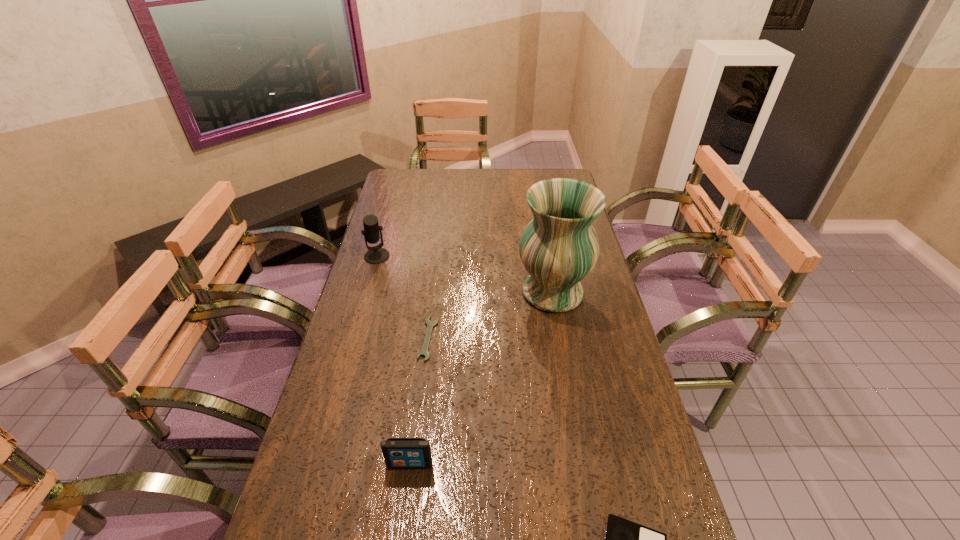
Where is `the tallest object`? The image size is (960, 540). the tallest object is located at coordinates (559, 247).

Find the location of a particular element. The height and width of the screenshot is (540, 960). microphone is located at coordinates (375, 255).

The width and height of the screenshot is (960, 540). What are the coordinates of `the leftmost object` in the screenshot? It's located at (375, 255).

Find the location of a particular element. The width and height of the screenshot is (960, 540). the third shortest object is located at coordinates (398, 452).

Find the location of a particular element. This screenshot has height=540, width=960. the farther iPod is located at coordinates (398, 452).

Locate an element on the screen. The width and height of the screenshot is (960, 540). wrench is located at coordinates (424, 352).

Where is `vacant space situated 0.050m on the left of the vase`? This screenshot has height=540, width=960. vacant space situated 0.050m on the left of the vase is located at coordinates (500, 292).

Locate an element on the screen. The height and width of the screenshot is (540, 960). free space located on the front of the microphone is located at coordinates (371, 279).

In order to click on vacant space located on the right of the wrench in this screenshot , I will do pyautogui.click(x=549, y=339).

The width and height of the screenshot is (960, 540). I want to click on object that is at the left edge, so click(x=375, y=255).